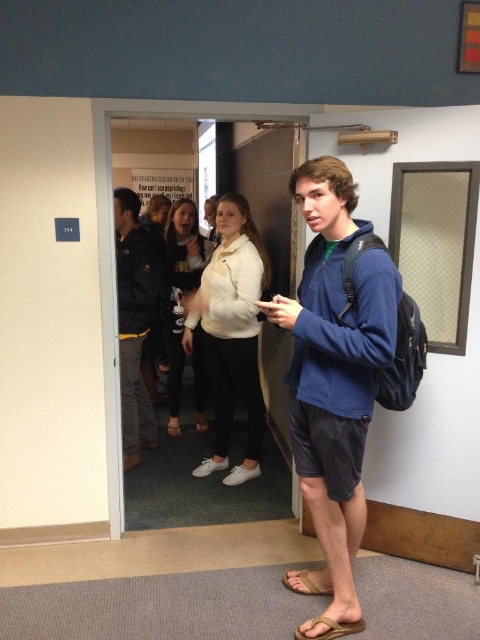
Question: Which of the following is the farthest from the observer?

Choices:
 (A) brown leather sandal at lower center
 (B) wooden door at center
 (C) blue fleece jacket at center
 (D) blue fleece sweatshirt at center

Answer: (B)

Question: Is white matte jacket at center to the right of wooden door at center from the viewer's perspective?

Choices:
 (A) yes
 (B) no

Answer: (B)

Question: Does white matte jacket at center appear on the right side of tan leather sandal at lower center?

Choices:
 (A) no
 (B) yes

Answer: (A)

Question: Based on their relative distances, which object is nearer to the wooden door at center?

Choices:
 (A) tan leather sandal at lower center
 (B) dark blue jacket at center
 (C) white soft sweater at center
 (D) blue fleece jacket at center

Answer: (C)

Question: Based on their relative distances, which object is nearer to the white soft sweater at center?

Choices:
 (A) wooden door at center
 (B) tan leather sandal at lower center

Answer: (A)

Question: Is brown leather sandal at lower center above tan leather sandal at lower center?

Choices:
 (A) yes
 (B) no

Answer: (B)